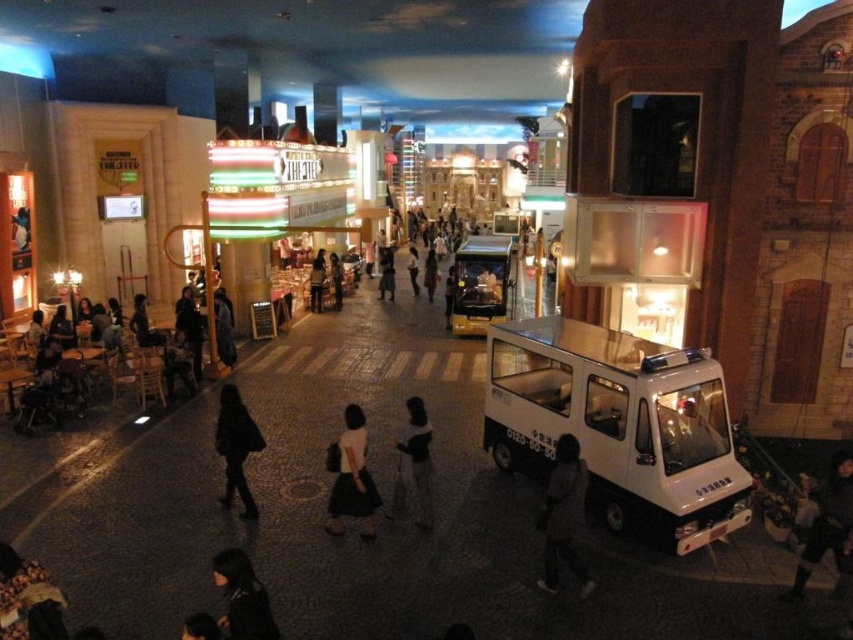
Can you confirm if dark gray fabric coat at center is bigger than black matte coat at center?

Incorrect, dark gray fabric coat at center is not larger than black matte coat at center.

At what (x,y) coordinates should I click in order to perform the action: click on dark gray fabric coat at center. Please return your answer as a coordinate pair (x, y). This screenshot has width=853, height=640. Looking at the image, I should click on (563, 516).

Is point (515, 429) positioned before point (688, 433)?

No, it is behind (688, 433).

Which is behind, point (502, 353) or point (688, 426)?

The point (502, 353) is more distant.

At what (x,y) coordinates should I click in order to perform the action: click on white plastic food truck at lower right. Please return your answer as a coordinate pair (x, y). Looking at the image, I should click on (619, 424).

The height and width of the screenshot is (640, 853). Describe the element at coordinates (480, 284) in the screenshot. I see `white plastic food truck at center` at that location.

Who is more distant from viewer, (459, 252) or (332, 280)?

The point (332, 280) is behind.

This screenshot has height=640, width=853. What are the coordinates of `white plastic food truck at center` in the screenshot? It's located at (480, 284).